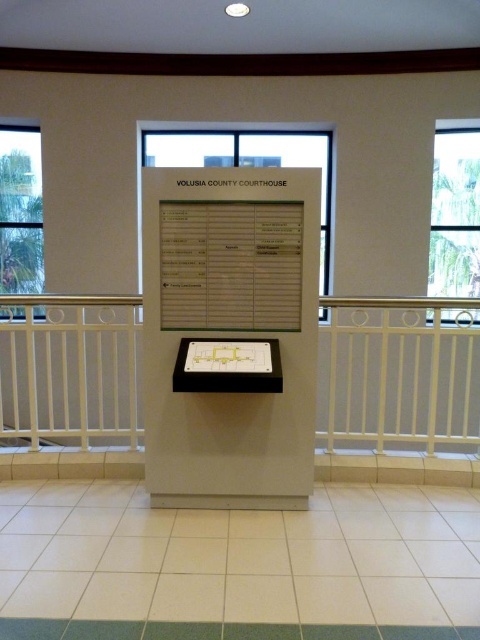
Question: Considering the relative positions of white metal balustrade at center and transparent glass window at center in the image provided, where is white metal balustrade at center located with respect to transparent glass window at center?

Choices:
 (A) above
 (B) below

Answer: (B)

Question: Which object is positioned farthest from the white paperboard at center?

Choices:
 (A) clear glass window at upper left
 (B) white glossy pillar at center
 (C) white metal balustrade at center
 (D) transparent glass window at center

Answer: (A)

Question: Which object is the closest to the clear glass window at upper right?

Choices:
 (A) yellow matte map at center
 (B) transparent glass window at center
 (C) white glossy pillar at center
 (D) clear glass window at upper left

Answer: (B)

Question: Is white glossy pillar at center to the left of transparent glass window at center from the viewer's perspective?

Choices:
 (A) no
 (B) yes

Answer: (B)

Question: Which point is farther from the camera taking this photo?

Choices:
 (A) (251, 349)
 (B) (319, 145)
 (C) (14, 148)
 (D) (287, 234)

Answer: (B)

Question: Is white metal balustrade at center wider than clear glass window at upper left?

Choices:
 (A) no
 (B) yes

Answer: (B)